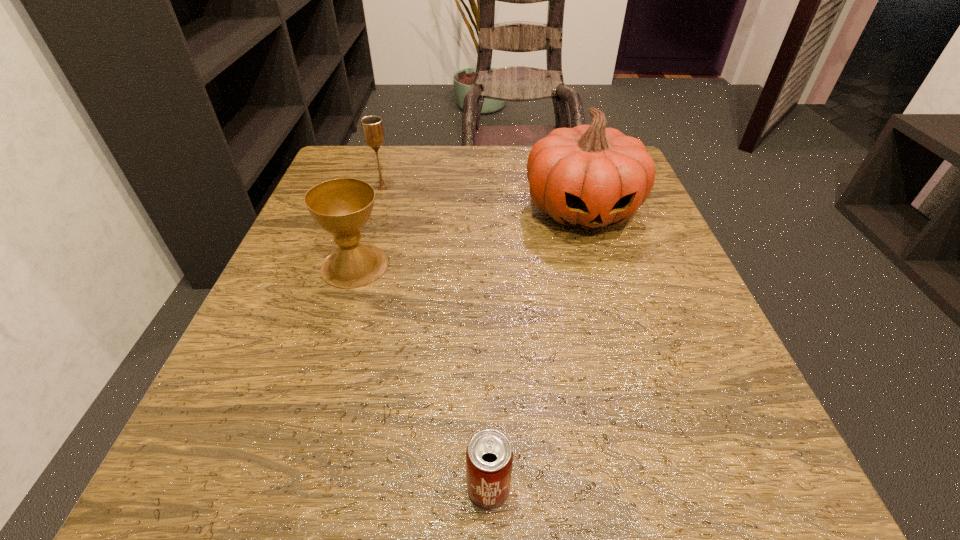
The image size is (960, 540). What are the coordinates of `free space at the far left corner` in the screenshot? It's located at point(348,159).

Identify the location of empty space that is in between the shortest object and the nearer chalice. (421, 377).

At what (x,y) coordinates should I click in order to perform the action: click on vacant region between the farther chalice and the nearer chalice. Please return your answer as a coordinate pair (x, y). Looking at the image, I should click on (369, 227).

This screenshot has height=540, width=960. I want to click on free point between the third object from left to right and the tallest object, so click(536, 349).

Where is `free space between the second object from right to left and the rightmost object`? The height and width of the screenshot is (540, 960). free space between the second object from right to left and the rightmost object is located at coordinates tap(536, 349).

I want to click on free space between the pumpkin and the nearer chalice, so click(x=468, y=238).

Where is `vacant space that is in between the shortest object and the farther chalice`? vacant space that is in between the shortest object and the farther chalice is located at coordinates (436, 339).

The width and height of the screenshot is (960, 540). Identify the location of unoccupied area between the farther chalice and the beer can. (436, 339).

Find the location of a particular element. This screenshot has height=540, width=960. free space between the pumpkin and the farther chalice is located at coordinates (482, 199).

Locate an element on the screen. vacant area that lies between the shortest object and the farther chalice is located at coordinates (436, 339).